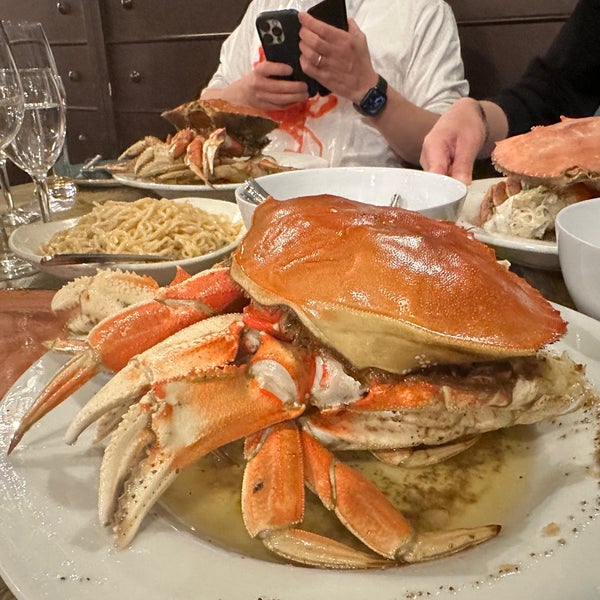
Image resolution: width=600 pixels, height=600 pixels. In order to click on empty white bowl in this screenshot , I will do `click(576, 252)`.